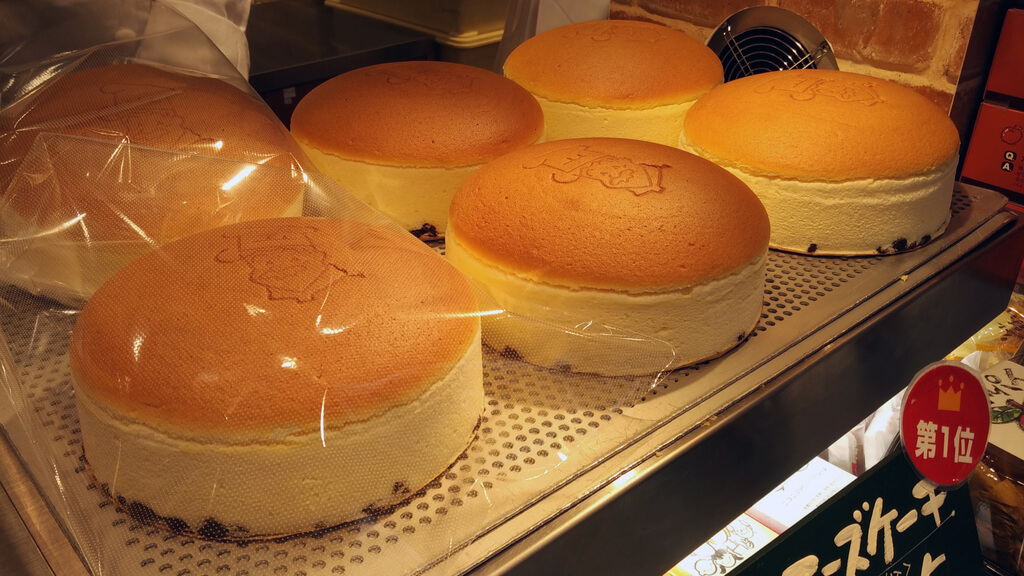
Where is `shelf`? shelf is located at coordinates (850, 392).